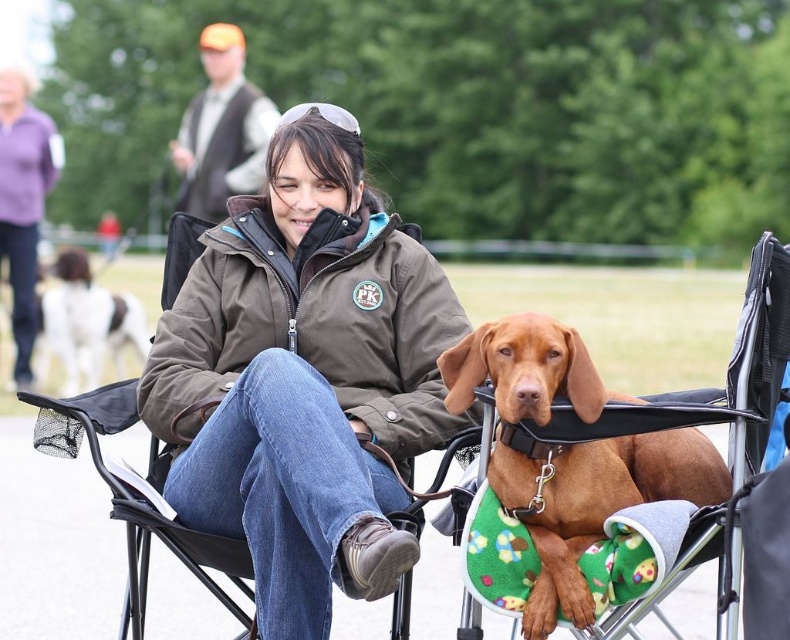
Question: Is purple fleece jacket at upper left in front of white fur dog at left?

Choices:
 (A) yes
 (B) no

Answer: (B)

Question: Is brown soft fabric dog at center bigger than purple fleece jacket at upper left?

Choices:
 (A) no
 (B) yes

Answer: (A)

Question: Which of these objects is positioned farthest from the orange fabric vest at upper left?

Choices:
 (A) brown soft fabric dog at center
 (B) brown soft jacket at center
 (C) white fur dog at left
 (D) purple fleece jacket at upper left

Answer: (A)

Question: Which object is positioned farthest from the brown soft fabric dog at center?

Choices:
 (A) purple fleece jacket at upper left
 (B) orange fabric vest at upper left
 (C) white fur dog at left
 (D) brown soft jacket at center

Answer: (A)

Question: Which of the following is the farthest from the observer?

Choices:
 (A) brown soft fabric dog at center
 (B) white fur dog at left

Answer: (B)

Question: Does orange fabric vest at upper left appear on the left side of purple fleece jacket at upper left?

Choices:
 (A) yes
 (B) no

Answer: (B)